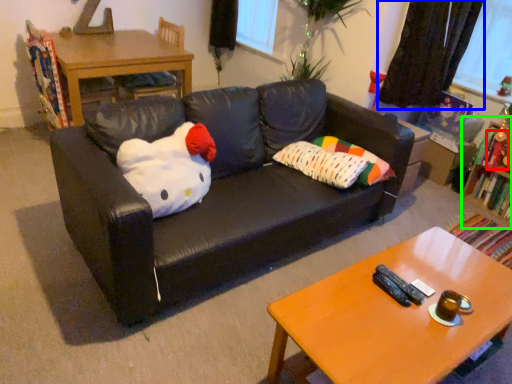
Question: Estimate the real-world distances between objects in this image. Which object is closer to toy (highlighted by a red box), curtain (highlighted by a blue box) or bookshelf (highlighted by a green box)?

Choices:
 (A) curtain
 (B) bookshelf

Answer: (B)